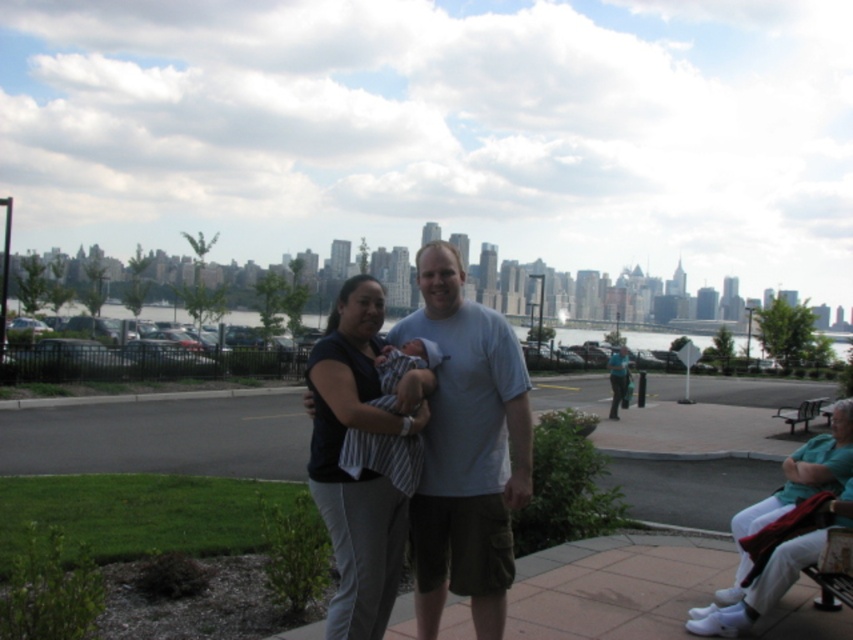
Does light blue t-shirt at center have a lesser width compared to striped fabric baby at center?

No, light blue t-shirt at center is not thinner than striped fabric baby at center.

Where is `light blue t-shirt at center`? This screenshot has height=640, width=853. light blue t-shirt at center is located at coordinates (466, 449).

Can you confirm if matte white shirt at center is taller than metallic silver bench at lower right?

Indeed, matte white shirt at center has a greater height compared to metallic silver bench at lower right.

Which is in front, point (624, 404) or point (772, 416)?

Positioned in front is point (624, 404).

Where is `matte white shirt at center`? matte white shirt at center is located at coordinates (618, 380).

Which is behind, point (415, 401) or point (619, 364)?

The point (619, 364) is more distant.

Is point (370, 353) positioned before point (616, 410)?

That is True.

Find the location of `dark blue fabric shirt at center`. dark blue fabric shirt at center is located at coordinates (x=363, y=470).